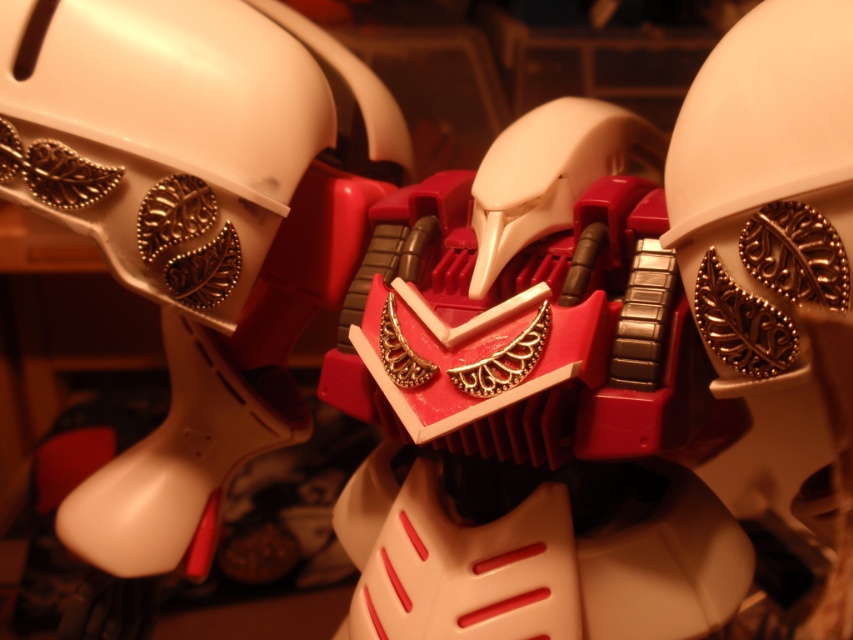
You are holding a camera and want to take a photo of the matte red plastic robot at center. If your camera requires the subject to be at least 18 inches away to focus properly, will you need to move closer or farther away to get a clear picture?

The matte red plastic robot at center is currently 16.70 inches away from the camera, which is closer than the required 18 inches. To get a clear picture, you need to move farther away to increase the distance to at least 18 inches.

From the picture: You are a collector arranging your Transformers collection. You have a matte red plastic robot at center and a white matte helmet at upper right. Which object is located more to the left in the image?

The matte red plastic robot at center is positioned on the left side of the white matte helmet at upper right, so it is more to the left.